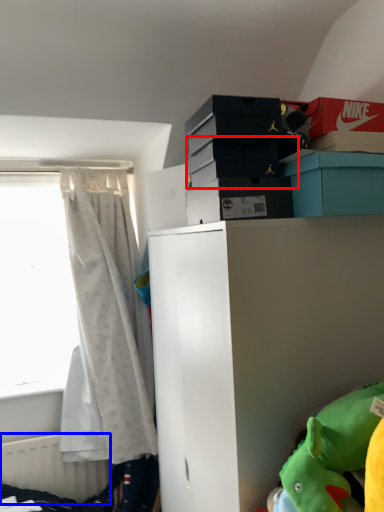
Question: Which object is closer to the camera taking this photo, storage box (highlighted by a red box) or radiator (highlighted by a blue box)?

Choices:
 (A) storage box
 (B) radiator

Answer: (A)